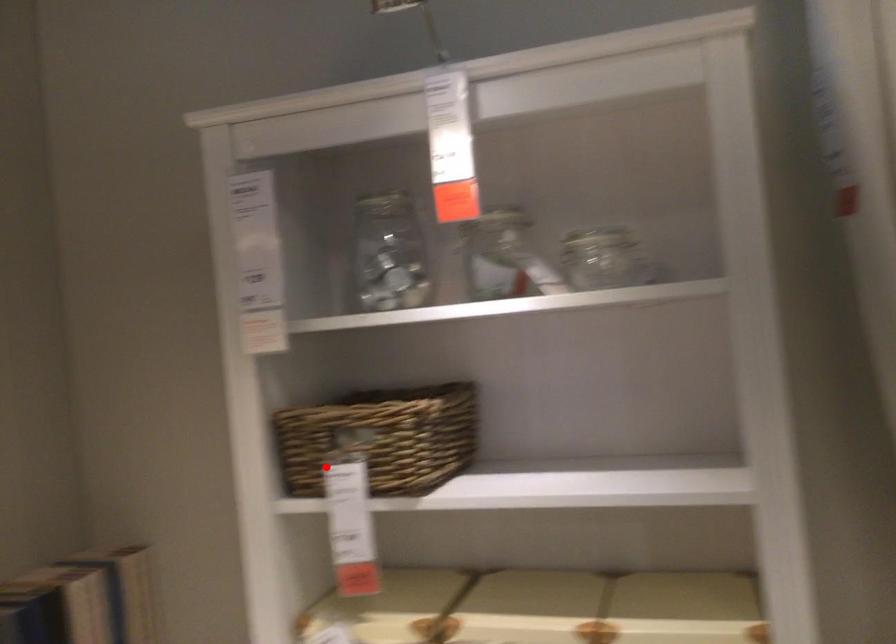
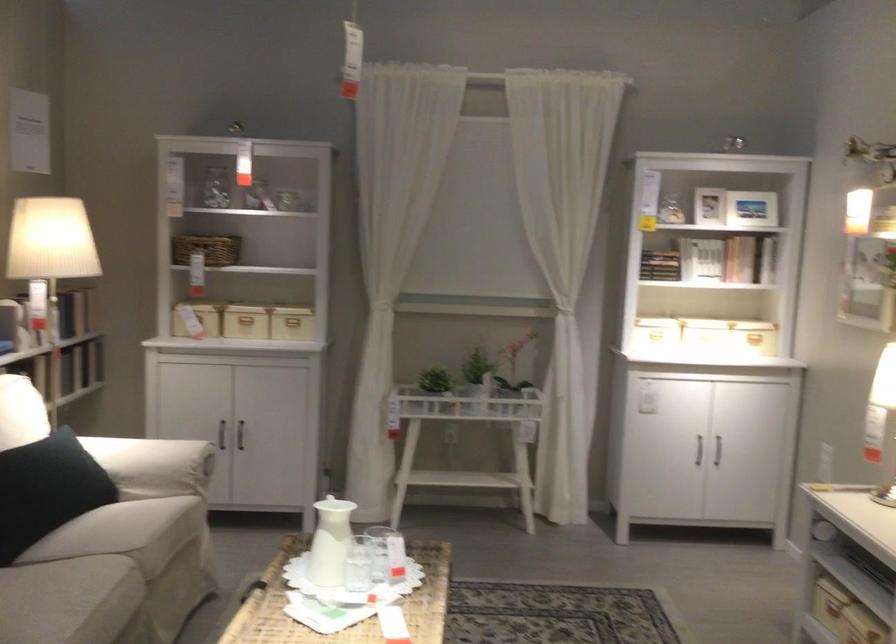
Question: I am providing you with two images of the same scene from different viewpoints. In image1, a red point is highlighted. Considering the same 3D point in image2, which of the following is correct?

Choices:
 (A) It is closer
 (B) It is farther

Answer: (B)